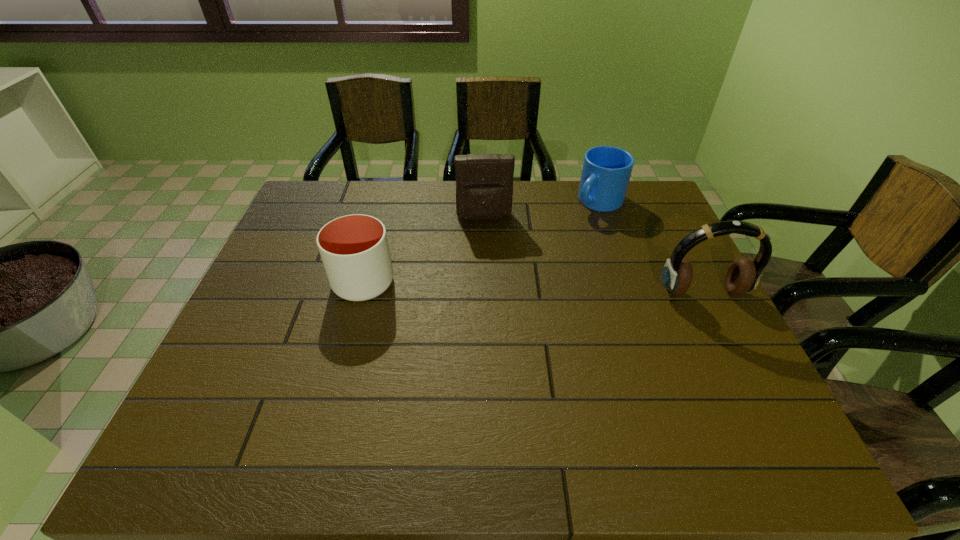
Find the location of `free area in between the headset and the leftmost object`. free area in between the headset and the leftmost object is located at coordinates (533, 287).

The height and width of the screenshot is (540, 960). Find the location of `the second closest object to the headset`. the second closest object to the headset is located at coordinates (484, 182).

Point out which object is positioned as the second nearest to the mug. Please provide its 2D coordinates. Your answer should be formatted as a tuple, i.e. [(x, y)], where the tuple contains the x and y coordinates of a point satisfying the conditions above.

[(744, 274)]

Where is `free region that satisfies the following two spatial constraints: 1. on the back side of the pouch; 2. on the right side of the mug`? free region that satisfies the following two spatial constraints: 1. on the back side of the pouch; 2. on the right side of the mug is located at coordinates (484, 201).